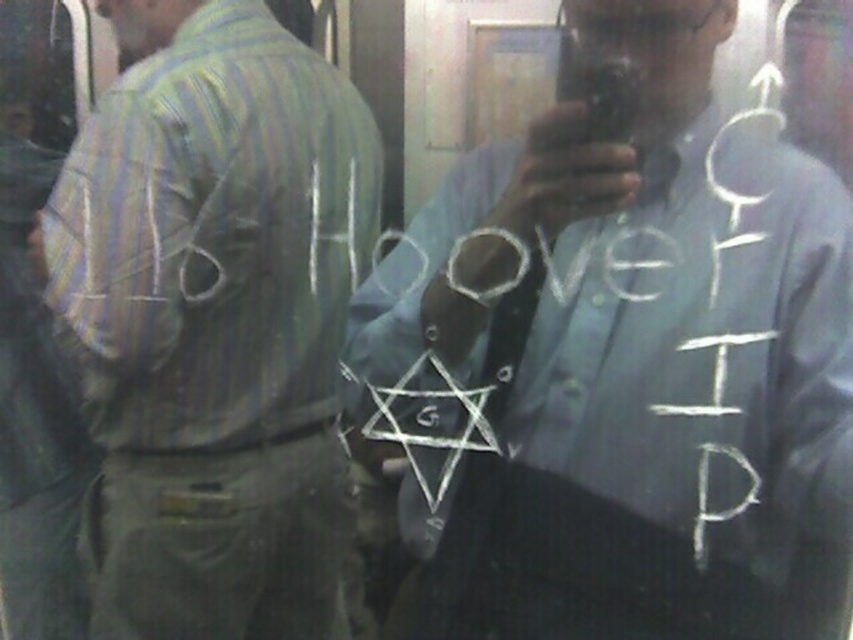
You are standing in a public transport vehicle and want to take a photo of the point at coordinates (367, 342). The camera you have can only focus on objects within 35 inches. Will the camera be able to focus on that point?

The distance of point (367, 342) from the camera is 37.50 inches, which is beyond the camera focus range of 35 inches. Therefore, the camera will not be able to focus on that point.

Based on the scene description, where is the light blue shirt at center located in relation to the point labeled as point (633, 360)?

The point (633, 360) indicates the location of the light blue shirt at center.

You are a passenger on a moving bus and you see a light blue shirt at center and a striped fabric shirt at left. Which shirt is taller?

The striped fabric shirt at left is taller than the light blue shirt at center.